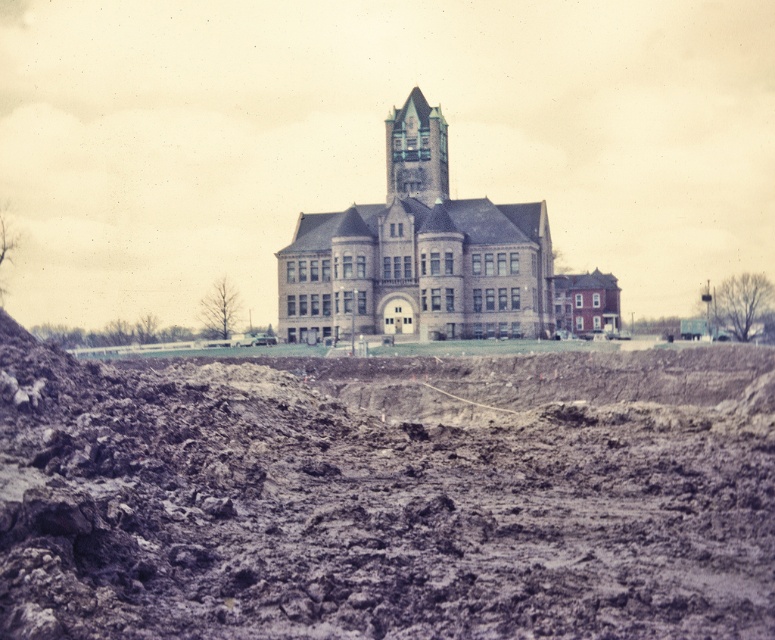
Can you confirm if clayey brown dirt at center is positioned to the left of blue glass tower at center?

Yes, clayey brown dirt at center is to the left of blue glass tower at center.

Between point (257, 609) and point (391, 118), which one is positioned behind?

Point (391, 118)

Which is behind, point (22, 477) or point (405, 182)?

The point (405, 182) is behind.

You are a GUI agent. You are given a task and a screenshot of the screen. Output one action in this format:
    pyautogui.click(x=<x>, y=<y>)
    Task: Click on the clayey brown dirt at center
    The height and width of the screenshot is (640, 775).
    Given the screenshot: What is the action you would take?
    pyautogui.click(x=386, y=496)

Is clayey brown dirt at center wider than brown stone church at center?

Indeed, clayey brown dirt at center has a greater width compared to brown stone church at center.

Is point (105, 625) closer to camera compared to point (424, 275)?

Yes, it is in front of point (424, 275).

Find the location of a particular element. clayey brown dirt at center is located at coordinates (386, 496).

Is brown stone church at center bigger than blue glass tower at center?

Yes.

Who is positioned more to the right, brown stone church at center or blue glass tower at center?

brown stone church at center is more to the right.

Which is behind, point (512, 294) or point (412, 88)?

The point (412, 88) is behind.

What are the coordinates of `brown stone church at center` in the screenshot? It's located at (432, 259).